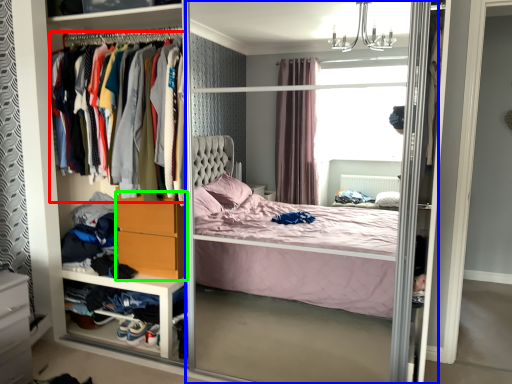
Question: Estimate the real-world distances between objects in this image. Which object is closer to clothing (highlighted by a red box), screen door (highlighted by a blue box) or dresser (highlighted by a green box)?

Choices:
 (A) screen door
 (B) dresser

Answer: (B)